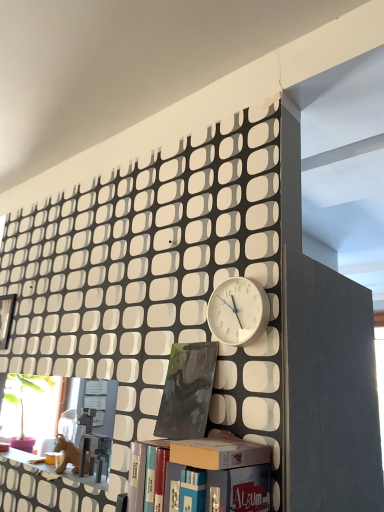
Question: From a real-world perspective, is matte plastic shelf at lower left above or below matte cardboard box at center?

Choices:
 (A) below
 (B) above

Answer: (A)

Question: Is matte plastic shelf at lower left wider or thinner than matte cardboard box at center?

Choices:
 (A) thin
 (B) wide

Answer: (A)

Question: Based on their relative distances, which object is nearer to the white matte clock at center?

Choices:
 (A) matte plastic shelf at lower left
 (B) hardcover book at center, the 2th book when ordered from back to front
 (C) dark green matte painting at center, the 2th book positioned from the front
 (D) matte cardboard box at center
 (E) matte black bookcase at lower center

Answer: (C)

Question: Which object is positioned closest to the matte cardboard box at center?

Choices:
 (A) dark green matte painting at center, the 2th book positioned from the front
 (B) hardcover book at center, the first book viewed from the front
 (C) matte black bookcase at lower center
 (D) matte plastic shelf at lower left
 (E) white matte clock at center

Answer: (B)